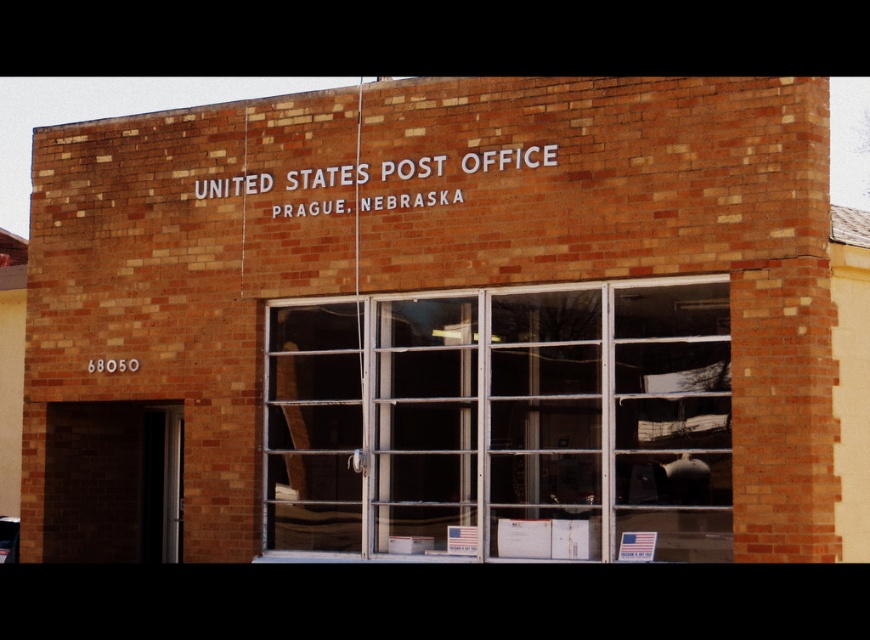
This screenshot has height=640, width=870. Describe the element at coordinates (502, 422) in the screenshot. I see `clear glass window at center` at that location.

Can you confirm if clear glass window at center is positioned to the left of white painted brick sign at upper center?

No, clear glass window at center is not to the left of white painted brick sign at upper center.

Who is more distant from viewer, (x=686, y=408) or (x=467, y=170)?

Point (x=467, y=170)

Find the location of a particular element. Image resolution: width=870 pixels, height=640 pixels. clear glass window at center is located at coordinates (502, 422).

Which is behind, point (628, 221) or point (493, 531)?

The point (493, 531) is behind.

Does brown brick building at center lie in front of clear glass window at center?

Yes, it is.

What do you see at coordinates (437, 321) in the screenshot?
I see `brown brick building at center` at bounding box center [437, 321].

Identify the location of brown brick building at center. (437, 321).

Who is taller, brown brick building at center or white painted brick sign at upper center?

With more height is white painted brick sign at upper center.

Does brown brick building at center come behind white painted brick sign at upper center?

No, brown brick building at center is closer to the viewer.

Describe the element at coordinates (437, 321) in the screenshot. The height and width of the screenshot is (640, 870). I see `brown brick building at center` at that location.

Where is `brown brick building at center`? Image resolution: width=870 pixels, height=640 pixels. brown brick building at center is located at coordinates (437, 321).